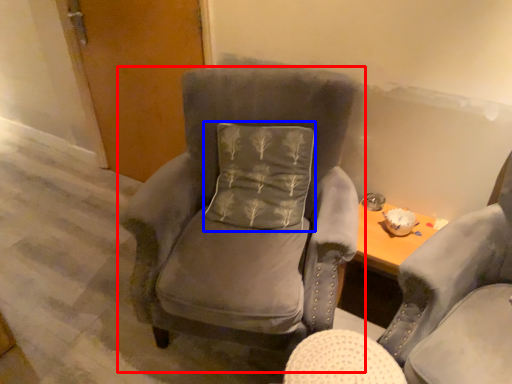
Question: Which object is further to the camera taking this photo, chair (highlighted by a red box) or pillow (highlighted by a blue box)?

Choices:
 (A) chair
 (B) pillow

Answer: (B)